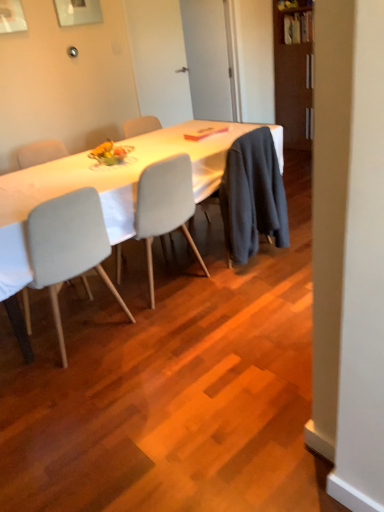
Identify the location of vacant space in front of light gray fabric chair at center, which ranks as the 2th chair in right-to-left order. The image size is (384, 512). (75, 391).